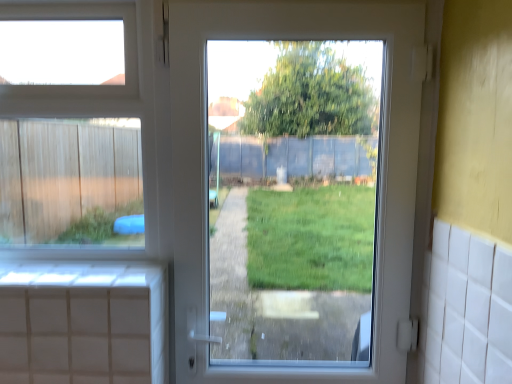
Question: Looking at their shapes, would you say transparent glass window at upper left is wider or thinner than white glossy door at center?

Choices:
 (A) thin
 (B) wide

Answer: (A)

Question: Considering the positions of transparent glass window at upper left and white glossy door at center in the image, is transparent glass window at upper left taller or shorter than white glossy door at center?

Choices:
 (A) tall
 (B) short

Answer: (B)

Question: Choose the correct answer: Is transparent glass window at upper left inside white glossy door at center or outside it?

Choices:
 (A) inside
 (B) outside

Answer: (B)

Question: From a real-world perspective, is white glossy door at center above or below transparent glass window at upper left?

Choices:
 (A) above
 (B) below

Answer: (B)

Question: Looking at their shapes, would you say white glossy door at center is wider or thinner than transparent glass window at upper left?

Choices:
 (A) wide
 (B) thin

Answer: (A)

Question: Considering the positions of point (373, 4) and point (147, 87), is point (373, 4) closer or farther from the camera than point (147, 87)?

Choices:
 (A) farther
 (B) closer

Answer: (B)

Question: Considering the positions of white glossy door at center and transparent glass window at upper left in the image, is white glossy door at center taller or shorter than transparent glass window at upper left?

Choices:
 (A) tall
 (B) short

Answer: (A)